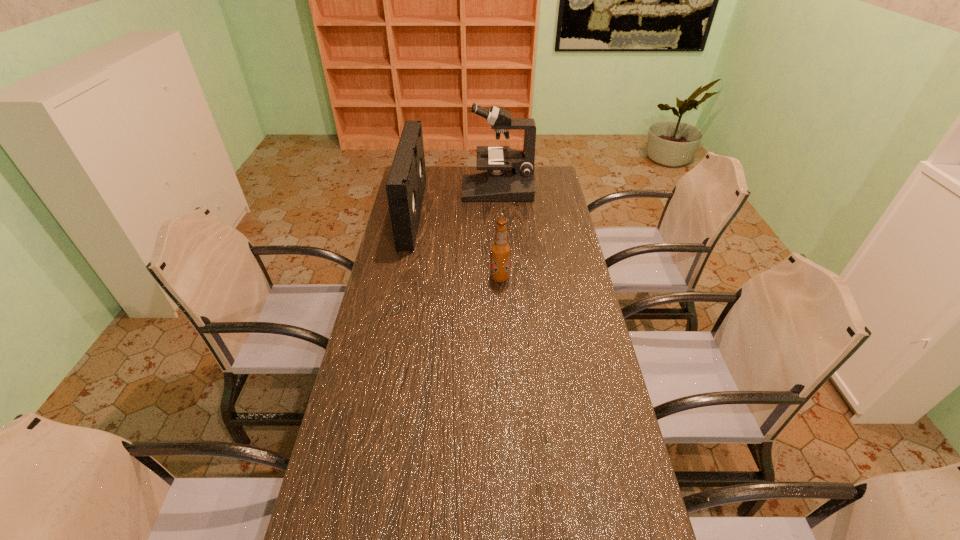
You are a GUI agent. You are given a task and a screenshot of the screen. Output one action in this format:
    pyautogui.click(x=<x>, y=<y>)
    Task: Click on the tallest object
    The width and height of the screenshot is (960, 540).
    Given the screenshot: What is the action you would take?
    pyautogui.click(x=510, y=173)

Identify the location of the third shortest object. (406, 183).

Identify the location of the leftmost object. (406, 183).

This screenshot has height=540, width=960. I want to click on the third tallest object, so click(500, 250).

What are the coordinates of `beer bottle` in the screenshot? It's located at (500, 250).

The image size is (960, 540). In order to click on vacant area situated 0.290m through the eyepieces of the tallest object in this screenshot , I will do `click(402, 190)`.

The width and height of the screenshot is (960, 540). Identify the location of vacant region located through the eyepieces of the tallest object. (436, 190).

At what (x,y) coordinates should I click in order to perform the action: click on free space located through the eyepieces of the tallest object. Please return your answer as a coordinate pair (x, y). Looking at the image, I should click on tap(402, 190).

Identify the location of vacant area situated 0.080m on the side of the leftmost object with visible spindles. Image resolution: width=960 pixels, height=540 pixels. (439, 213).

The height and width of the screenshot is (540, 960). Find the location of `vacant area situated 0.060m on the front label of the second nearest object`. vacant area situated 0.060m on the front label of the second nearest object is located at coordinates (473, 278).